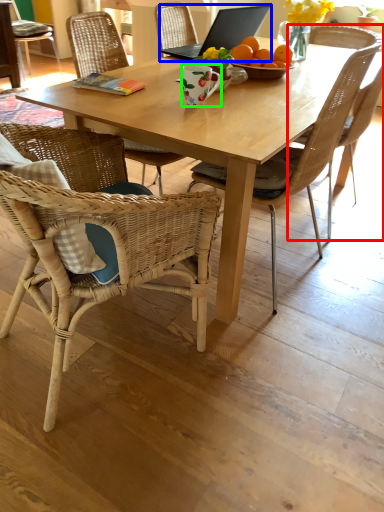
Question: Estimate the real-world distances between objects in this image. Which object is farther from chair (highlighted by a red box), laptop (highlighted by a blue box) or coffee cup (highlighted by a green box)?

Choices:
 (A) laptop
 (B) coffee cup

Answer: (B)